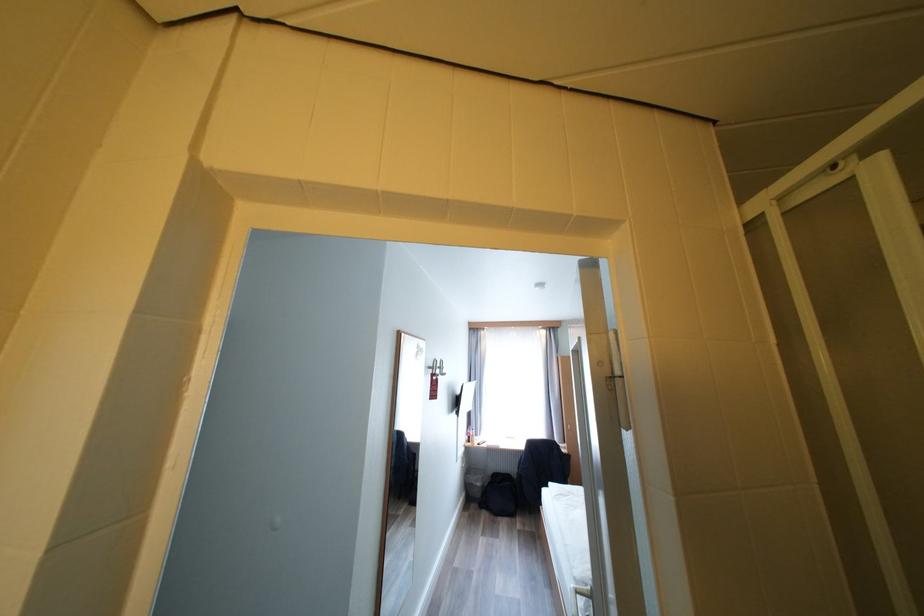
Describe the element at coordinates (614, 477) in the screenshot. I see `the white shower door handle` at that location.